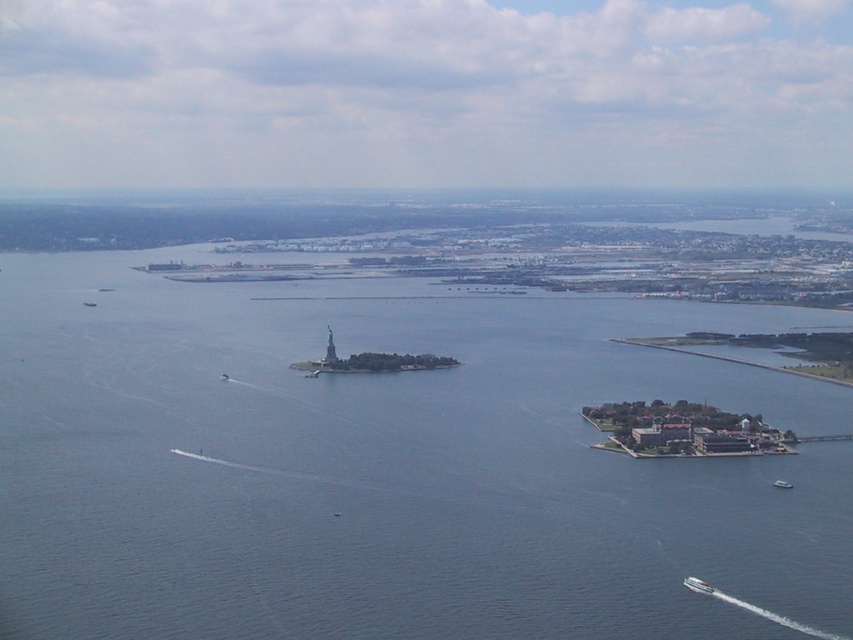
What do you see at coordinates (392, 467) in the screenshot?
I see `blue water at center` at bounding box center [392, 467].

Between blue water at center and white plastic boat at lower right, which one appears on the right side from the viewer's perspective?

white plastic boat at lower right is more to the right.

Identify the location of blue water at center. (392, 467).

What do you see at coordinates (698, 586) in the screenshot?
I see `white glossy boat at lower right` at bounding box center [698, 586].

Is white glossy boat at lower right shorter than white plastic boat at lower right?

In fact, white glossy boat at lower right may be taller than white plastic boat at lower right.

Locate an element on the screen. This screenshot has width=853, height=640. white glossy boat at lower right is located at coordinates (698, 586).

Does blue water at center have a smaller size compared to white glossy boat at lower right?

Incorrect, blue water at center is not smaller in size than white glossy boat at lower right.

Can you confirm if blue water at center is positioned to the left of white glossy boat at lower right?

Indeed, blue water at center is positioned on the left side of white glossy boat at lower right.

Locate an element on the screen. Image resolution: width=853 pixels, height=640 pixels. blue water at center is located at coordinates (392, 467).